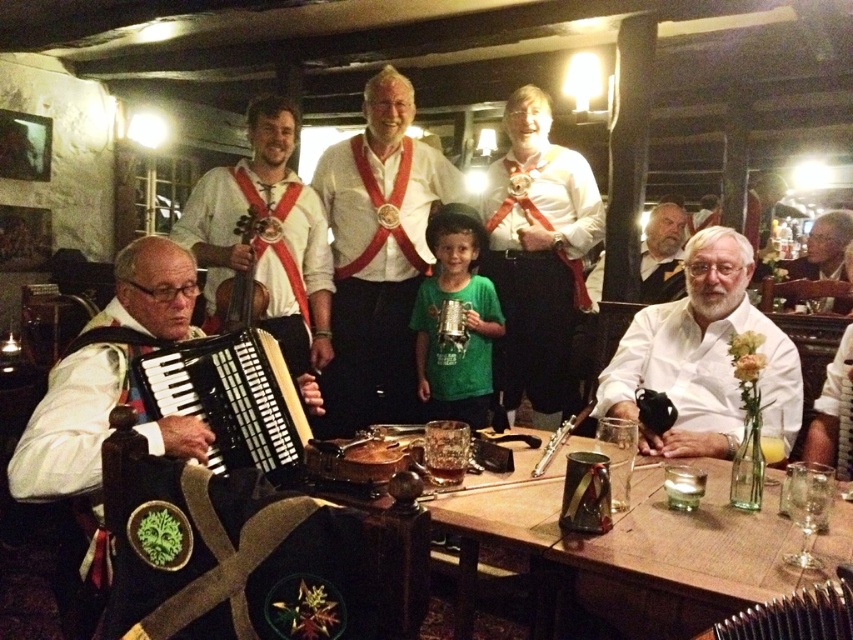
Question: Which is farther from the white shirt with red sash at center?

Choices:
 (A) white shirt at upper right
 (B) metallic silver accordion at center

Answer: (A)

Question: Can you confirm if white matte shirt at right is positioned to the right of metallic silver accordion at center?

Choices:
 (A) yes
 (B) no

Answer: (A)

Question: Which point is farther to the camera?

Choices:
 (A) (773, 417)
 (B) (219, 376)
 (C) (669, 554)
 (D) (840, 269)

Answer: (D)

Question: Among these objects, which one is farthest from the camera?

Choices:
 (A) metallic silver accordion at center
 (B) white shirt with red sash at center

Answer: (B)

Question: Does white shirt with red sash at center have a smaller size compared to wooden violin at center?

Choices:
 (A) no
 (B) yes

Answer: (A)

Question: Is white shirt at upper right further to camera compared to metallic silver accordion at center?

Choices:
 (A) yes
 (B) no

Answer: (A)